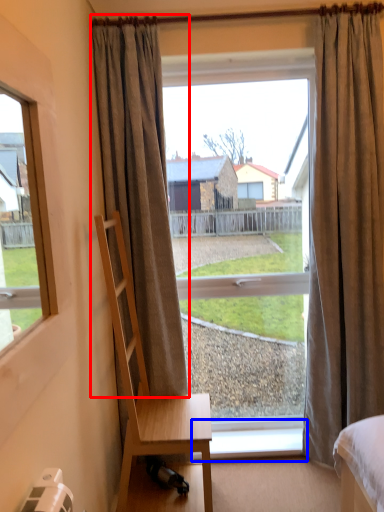
Question: Which of the following is the farthest to the observer, curtain (highlighted by a red box) or window sill (highlighted by a blue box)?

Choices:
 (A) curtain
 (B) window sill

Answer: (B)